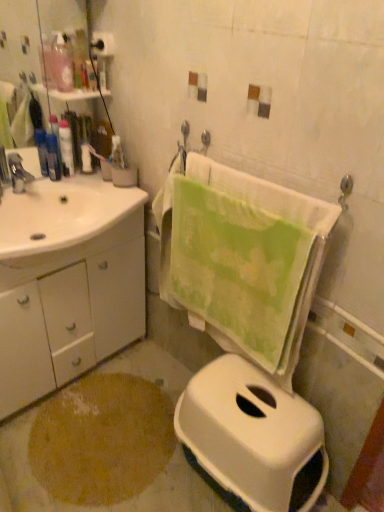
Locate an element on the screen. The image size is (384, 512). empty space that is ontop of brown textured rug at lower left (from a real-world perspective) is located at coordinates (98, 423).